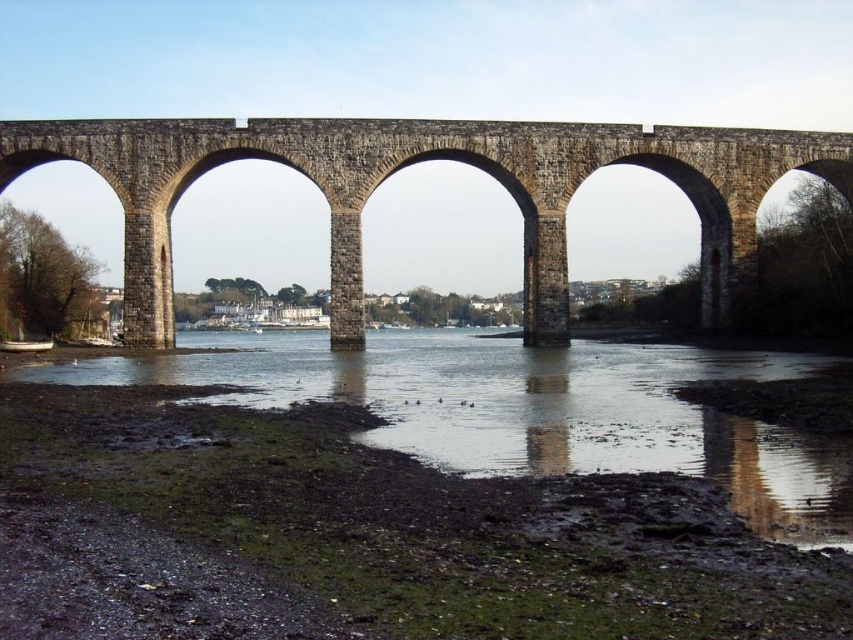
You are standing at the muddy wet sand at lower left and want to walk to the stone arch bridge at center. Is the path between them wide enough for you to walk comfortably?

The muddy wet sand at lower left is thinner than the stone arch bridge at center, so the path between them may be narrow. However, since the bridge is wider, there should be enough space to walk comfortably.

You are standing on the muddy wet sand at lower left and want to cross to the stone arch bridge at center. Is the bridge directly to your right or left?

The muddy wet sand at lower left is positioned on the left side of stone arch bridge at center, so the bridge is directly to your right.

You are standing on the muddy wet sand at lower left and want to cross to the stone arch bridge at center. Is the bridge higher than the sand? Please explain.

The stone arch bridge at center is taller than the muddy wet sand at lower left, so yes, the bridge is higher than the sand.